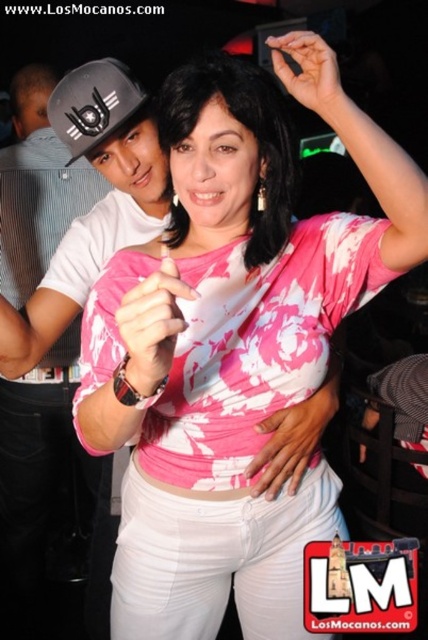
Question: Which of the following is the farthest from the observer?

Choices:
 (A) matte black baseball cap at upper left
 (B) matte white t-shirt at upper left

Answer: (B)

Question: Which of the following is the closest to the observer?

Choices:
 (A) matte white t-shirt at upper left
 (B) matte black baseball cap at upper left

Answer: (B)

Question: Does matte white t-shirt at upper left come behind matte black baseball cap at upper left?

Choices:
 (A) yes
 (B) no

Answer: (A)

Question: Considering the relative positions of matte white t-shirt at upper left and matte black baseball cap at upper left in the image provided, where is matte white t-shirt at upper left located with respect to matte black baseball cap at upper left?

Choices:
 (A) below
 (B) above

Answer: (A)

Question: Does matte white t-shirt at upper left have a lesser width compared to matte black baseball cap at upper left?

Choices:
 (A) no
 (B) yes

Answer: (A)